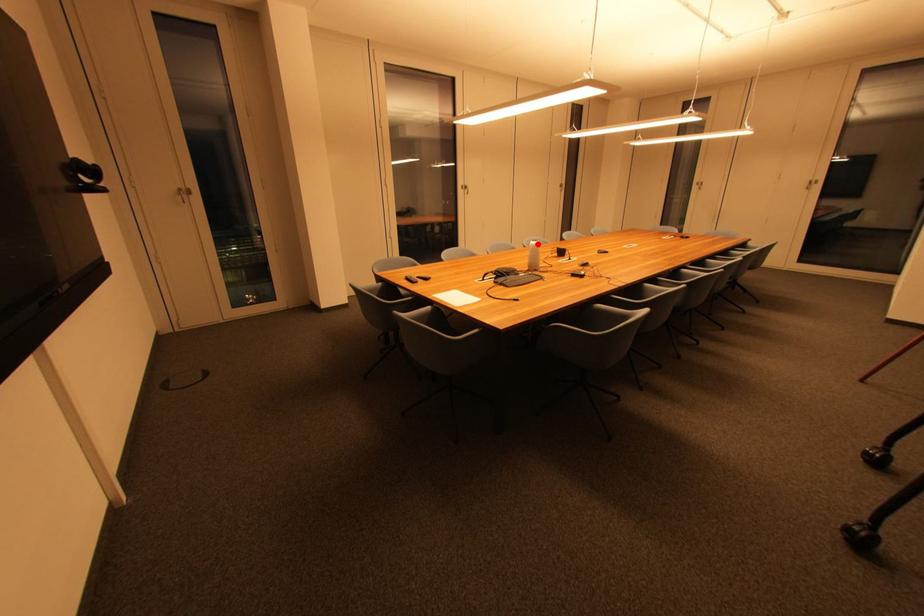
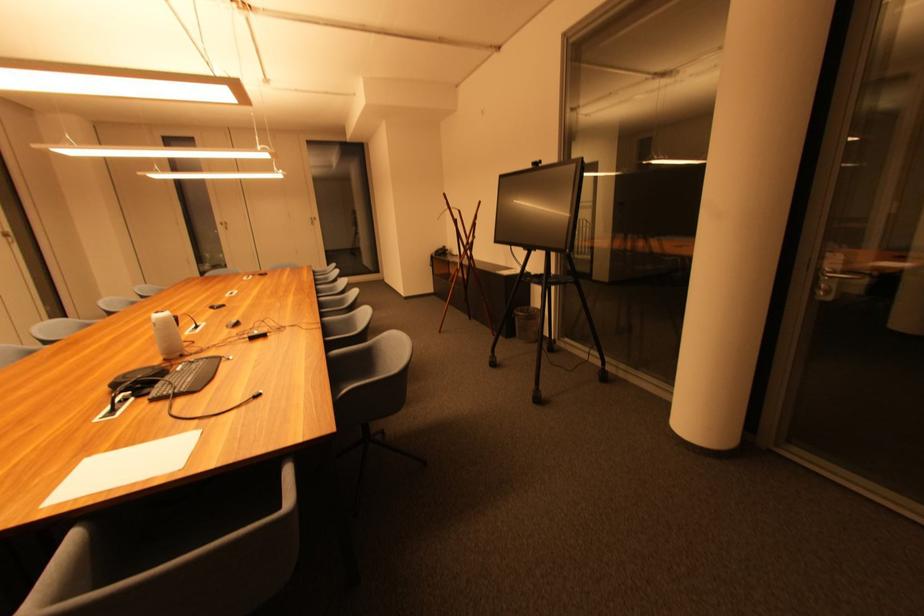
Question: I am providing you with two images of the same scene from different viewpoints. A red point is marked on the first image. Can you still see the location of the red point in image 2?

Choices:
 (A) Yes
 (B) No

Answer: (A)